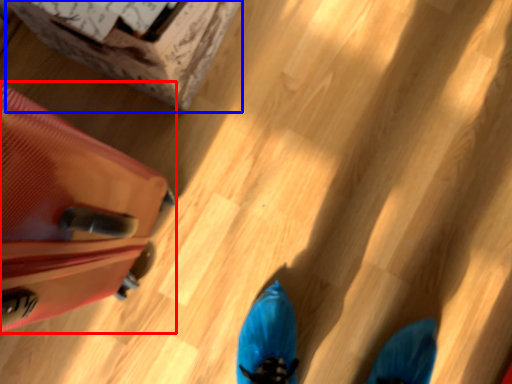
Question: Which object is closer to the camera taking this photo, luggage (highlighted by a red box) or cardboard box (highlighted by a blue box)?

Choices:
 (A) luggage
 (B) cardboard box

Answer: (A)